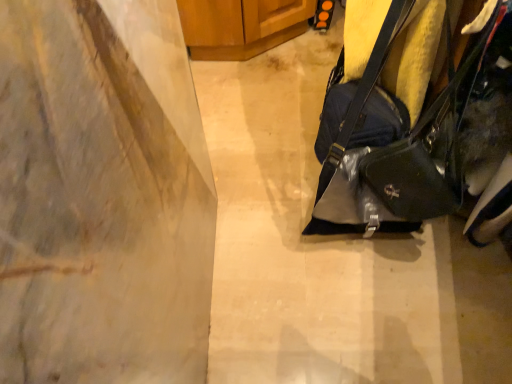
Question: Considering the relative positions of matte gray concrete at center and wooden cabinet at upper center in the image provided, is matte gray concrete at center behind wooden cabinet at upper center?

Choices:
 (A) no
 (B) yes

Answer: (A)

Question: Does matte gray concrete at center touch wooden cabinet at upper center?

Choices:
 (A) no
 (B) yes

Answer: (A)

Question: Is wooden cabinet at upper center located within matte gray concrete at center?

Choices:
 (A) no
 (B) yes

Answer: (A)

Question: Does matte gray concrete at center have a larger size compared to wooden cabinet at upper center?

Choices:
 (A) yes
 (B) no

Answer: (B)

Question: From a real-world perspective, does matte gray concrete at center sit lower than wooden cabinet at upper center?

Choices:
 (A) no
 (B) yes

Answer: (B)

Question: Can you confirm if matte gray concrete at center is wider than wooden cabinet at upper center?

Choices:
 (A) no
 (B) yes

Answer: (B)

Question: Is glossy black handbag at right to the left of wooden cabinet at upper center from the viewer's perspective?

Choices:
 (A) yes
 (B) no

Answer: (B)

Question: Considering the relative sizes of glossy black handbag at right and wooden cabinet at upper center in the image provided, is glossy black handbag at right taller than wooden cabinet at upper center?

Choices:
 (A) no
 (B) yes

Answer: (B)

Question: From a real-world perspective, is glossy black handbag at right under wooden cabinet at upper center?

Choices:
 (A) no
 (B) yes

Answer: (A)

Question: Considering the relative sizes of glossy black handbag at right and wooden cabinet at upper center in the image provided, is glossy black handbag at right wider than wooden cabinet at upper center?

Choices:
 (A) no
 (B) yes

Answer: (A)

Question: Is glossy black handbag at right oriented away from wooden cabinet at upper center?

Choices:
 (A) yes
 (B) no

Answer: (B)

Question: Is glossy black handbag at right outside wooden cabinet at upper center?

Choices:
 (A) yes
 (B) no

Answer: (A)

Question: From a real-world perspective, is matte gray concrete at center beneath glossy black handbag at right?

Choices:
 (A) yes
 (B) no

Answer: (A)